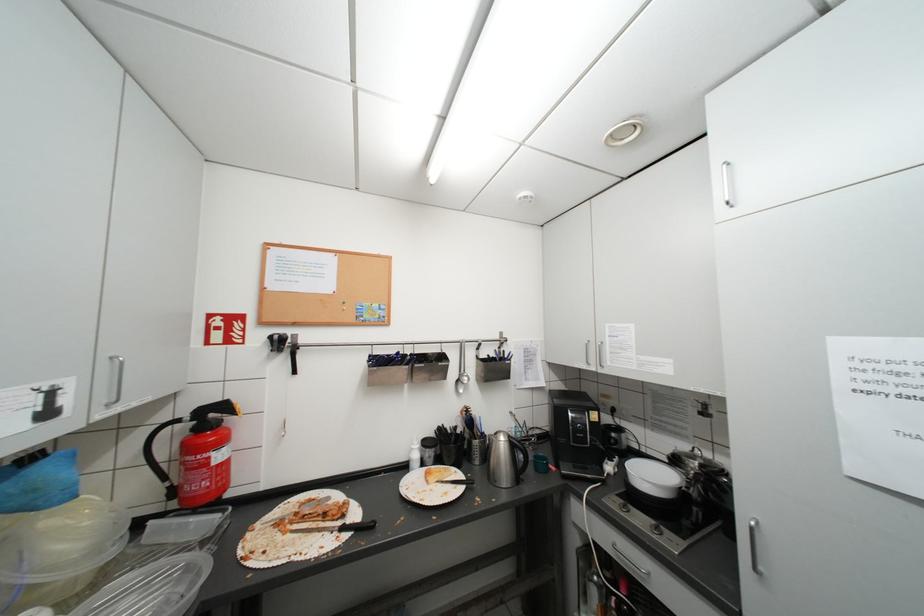
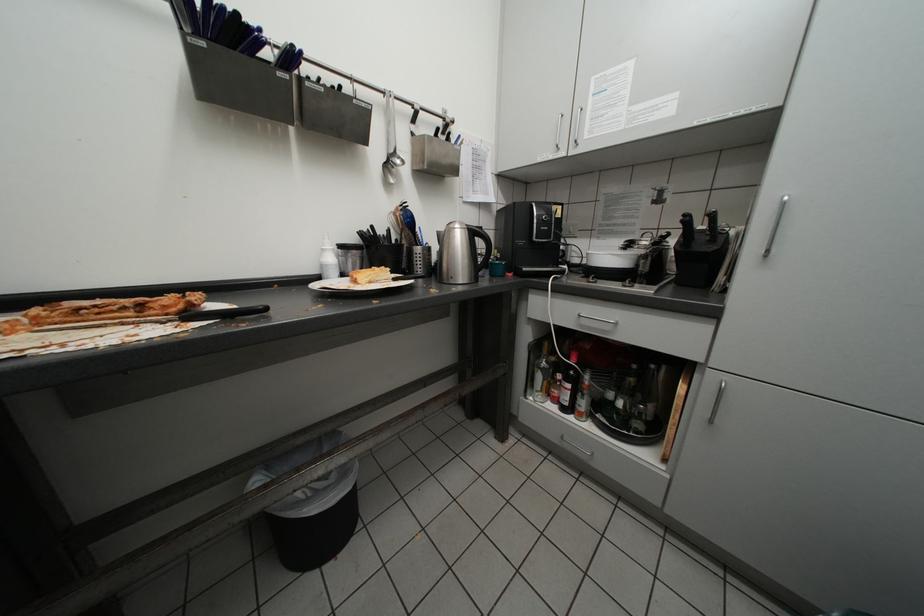
The images are taken continuously from a first-person perspective. In which direction is your viewpoint rotating?

A: The rotation direction of the camera is right-down.